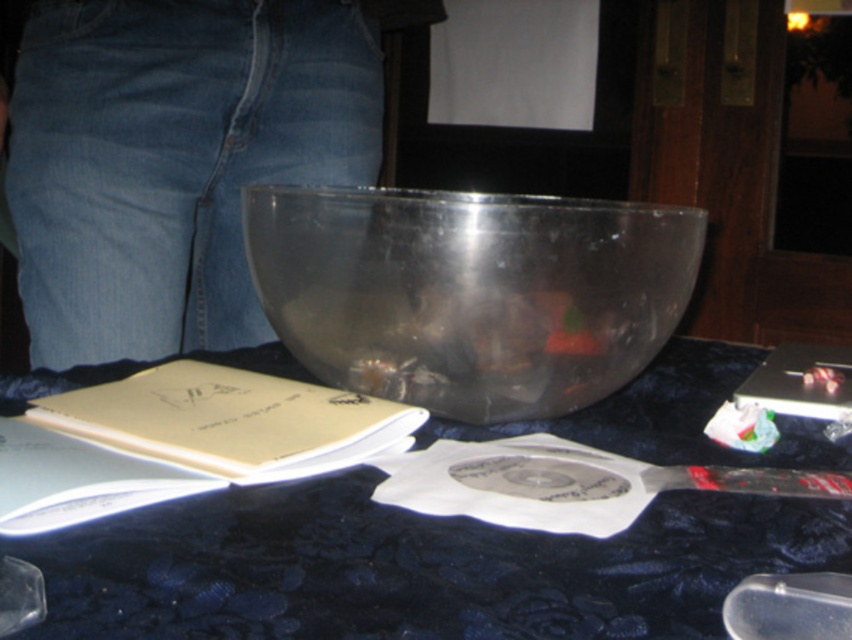
You are trying to reach for the transparent plastic spoon at lower right while standing in front of the transparent plastic table at center. Which object will you touch first?

You will touch the transparent plastic table at center first because it is closer to you than the transparent plastic spoon at lower right.

You are organizing items on a dark blue tablecloth. You have a transparent plastic table at center and a denim at center. Which item is positioned to the right of the other?

The transparent plastic table at center is to the right of denim at center.

You are organizing items on a dark blue tablecloth and want to place both the denim at center and the transparent plastic bowl at center. Which item should you move first to ensure there is enough space for both?

The denim at center has a larger width than the transparent plastic bowl at center, so you should move the denim at center first to accommodate its wider size before placing the transparent plastic bowl at center.